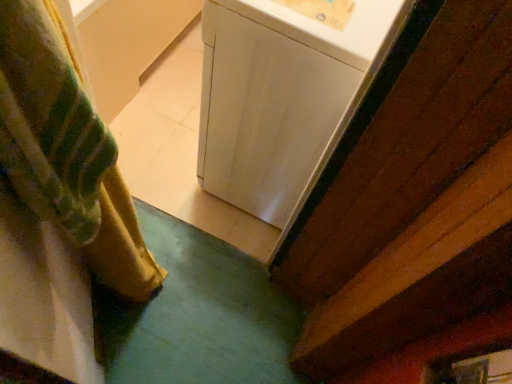
Question: Is white glossy washing machine at center placed right next to velvety green curtain at left?

Choices:
 (A) yes
 (B) no

Answer: (B)

Question: Considering the relative sizes of white glossy washing machine at center and velvety green curtain at left in the image provided, is white glossy washing machine at center smaller than velvety green curtain at left?

Choices:
 (A) no
 (B) yes

Answer: (A)

Question: Does white glossy washing machine at center come behind velvety green curtain at left?

Choices:
 (A) no
 (B) yes

Answer: (B)

Question: Considering the relative sizes of white glossy washing machine at center and velvety green curtain at left in the image provided, is white glossy washing machine at center shorter than velvety green curtain at left?

Choices:
 (A) no
 (B) yes

Answer: (B)

Question: Is white glossy washing machine at center at the right side of velvety green curtain at left?

Choices:
 (A) no
 (B) yes

Answer: (B)

Question: Is white glossy washing machine at center facing towards velvety green curtain at left?

Choices:
 (A) yes
 (B) no

Answer: (B)

Question: Is white glossy washing machine at center surrounded by velvety green curtain at left?

Choices:
 (A) yes
 (B) no

Answer: (B)

Question: Does velvety green curtain at left appear on the right side of white glossy washing machine at center?

Choices:
 (A) yes
 (B) no

Answer: (B)

Question: Could you tell me if velvety green curtain at left is facing white glossy washing machine at center?

Choices:
 (A) no
 (B) yes

Answer: (A)

Question: From the image's perspective, is velvety green curtain at left located above white glossy washing machine at center?

Choices:
 (A) no
 (B) yes

Answer: (A)

Question: Does velvety green curtain at left have a lesser width compared to white glossy washing machine at center?

Choices:
 (A) yes
 (B) no

Answer: (A)

Question: Considering the relative positions of velvety green curtain at left and white glossy washing machine at center in the image provided, is velvety green curtain at left to the left of white glossy washing machine at center from the viewer's perspective?

Choices:
 (A) no
 (B) yes

Answer: (B)

Question: Is point (225, 125) positioned closer to the camera than point (51, 150)?

Choices:
 (A) farther
 (B) closer

Answer: (A)